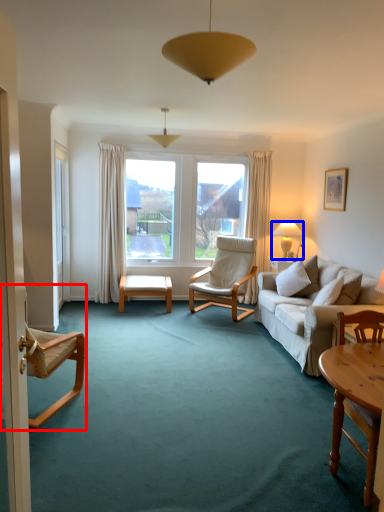
Question: Which object is further to the camera taking this photo, chair (highlighted by a red box) or lamp (highlighted by a blue box)?

Choices:
 (A) chair
 (B) lamp

Answer: (B)